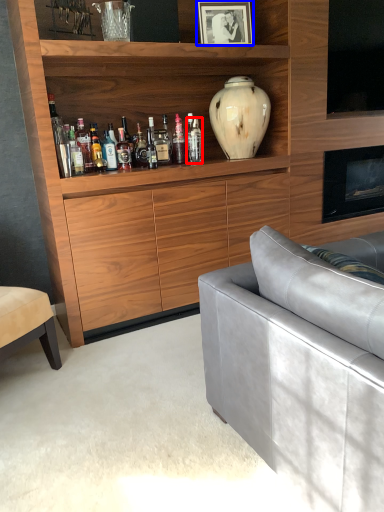
Question: Which point is further to the camera, bottle (highlighted by a red box) or picture frame (highlighted by a blue box)?

Choices:
 (A) bottle
 (B) picture frame

Answer: (A)